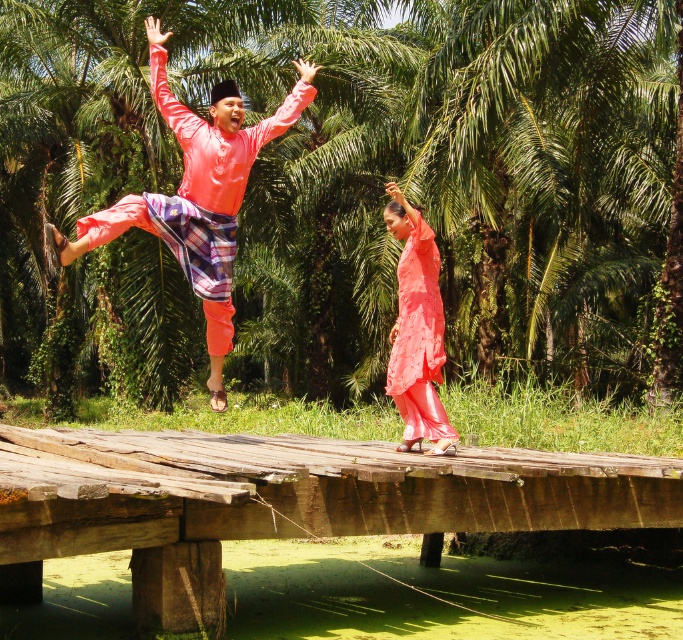
Can you confirm if green leafy palm tree at upper center is positioned to the left of matte coral fabric dress at center?

Yes, green leafy palm tree at upper center is to the left of matte coral fabric dress at center.

Does green leafy palm tree at upper center have a lesser height compared to matte coral fabric dress at center?

Incorrect, green leafy palm tree at upper center's height does not fall short of matte coral fabric dress at center's.

Does point (574, 24) come closer to viewer compared to point (398, 380)?

No, it is behind (398, 380).

Find the location of a particular element. This screenshot has height=640, width=683. green leafy palm tree at upper center is located at coordinates (350, 189).

In the scene shown: Who is more forward, (309, 93) or (391, 380)?

Point (309, 93) is more forward.

Between shiny pink shirt at upper center and matte coral fabric dress at center, which one has more height?

With more height is shiny pink shirt at upper center.

Between point (229, 148) and point (421, 228), which one is positioned behind?

The point (421, 228) is behind.

You are a GUI agent. You are given a task and a screenshot of the screen. Output one action in this format:
    pyautogui.click(x=<x>, y=<y>)
    Task: Click on the shiny pink shirt at upper center
    Image resolution: width=683 pixels, height=640 pixels.
    Given the screenshot: What is the action you would take?
    pyautogui.click(x=195, y=195)

Measure the distance between wooden bridge at center and camera.

wooden bridge at center is 5.69 meters from camera.

Identify the location of wooden bridge at center. This screenshot has width=683, height=640. (281, 502).